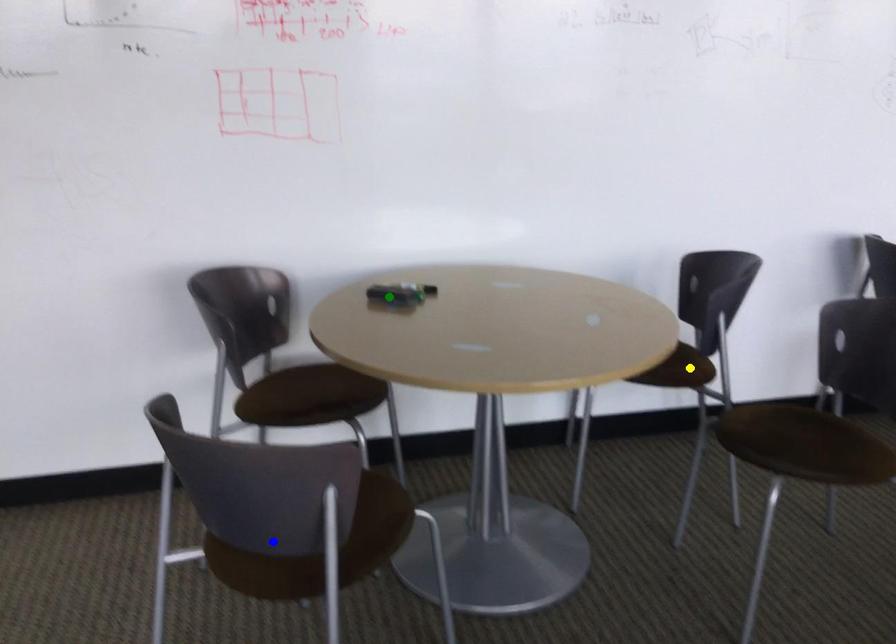
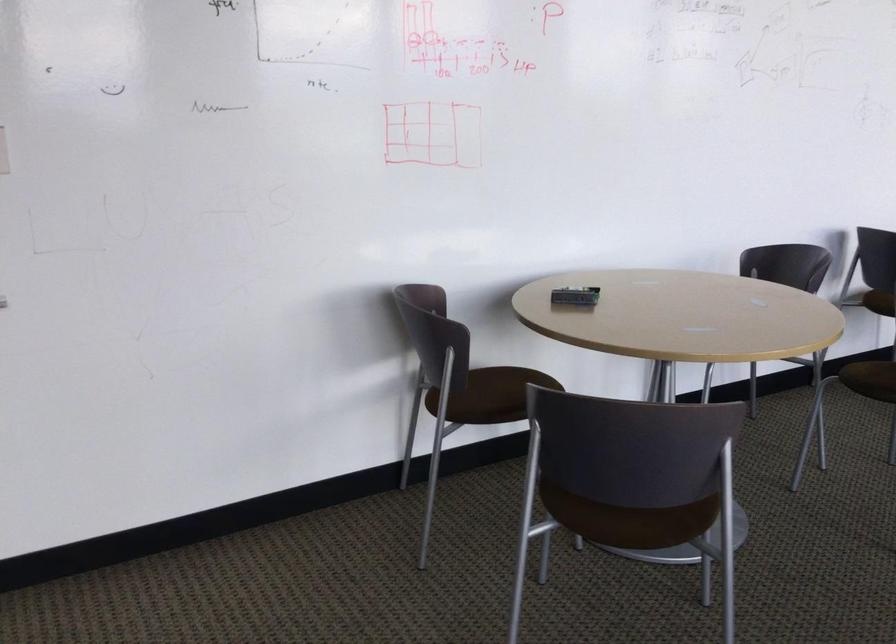
I am providing you with two images of the same scene from different viewpoints. Three points are marked in image1. Which point corresponds to a part or object that is occluded in image2?In image1, three points are marked. Which of them correspond to a part or object that is occluded in image2?Among the three points shown in image1, which one corresponds to a part or object that is no longer visible due to occlusion in image2?

yellow point cannot be seen in image2.